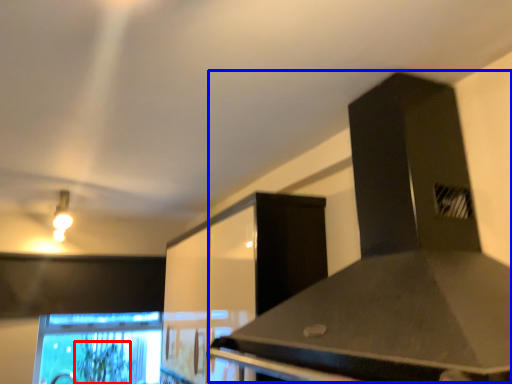
Question: Which object is closer to the camera taking this photo, plant (highlighted by a red box) or vent (highlighted by a blue box)?

Choices:
 (A) plant
 (B) vent

Answer: (B)